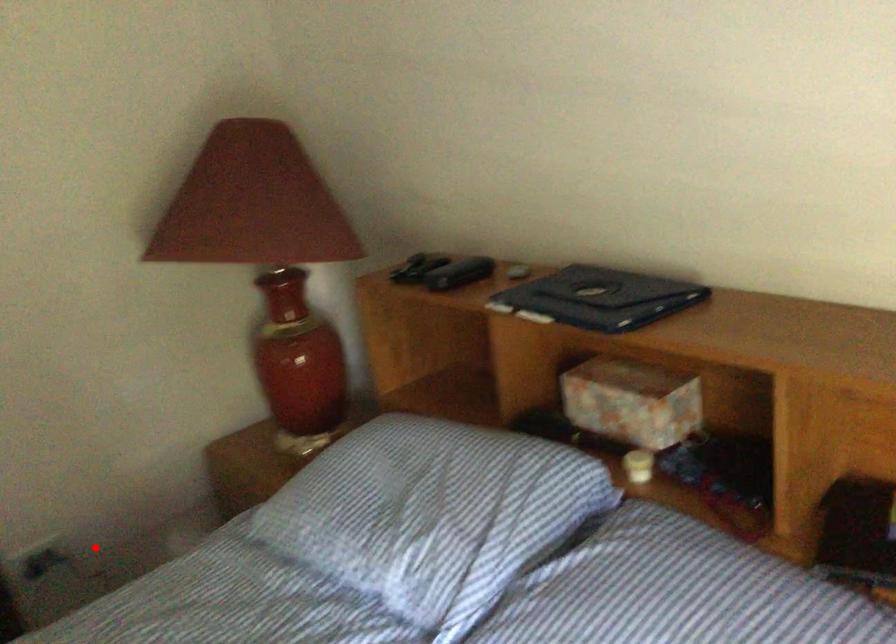
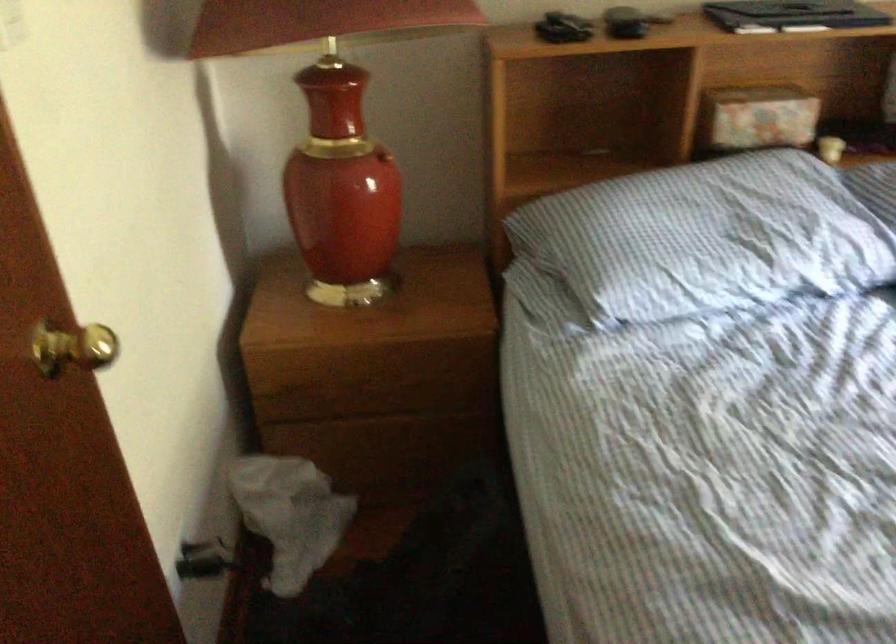
Find the pixel in the second image that matches the highlighted location in the first image.

(204, 560)